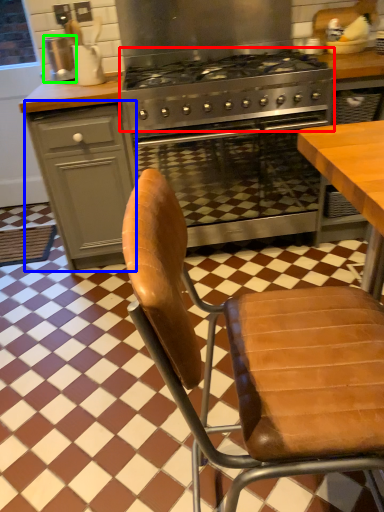
Question: Which is nearer to the gas stove (highlighted by a red box)? cabinetry (highlighted by a blue box) or appliance (highlighted by a green box).

Choices:
 (A) cabinetry
 (B) appliance

Answer: (A)